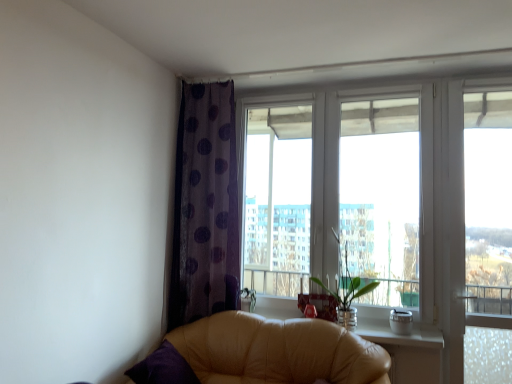
Question: Does point (232, 165) appear closer or farther from the camera than point (377, 372)?

Choices:
 (A) closer
 (B) farther

Answer: (B)

Question: From their relative heights in the image, would you say purple dotted curtain at left is taller or shorter than leather couch at lower left?

Choices:
 (A) tall
 (B) short

Answer: (A)

Question: Which is farther from the purple dotted curtain at left?

Choices:
 (A) green glass vase at center
 (B) leather couch at lower left
 (C) transparent plastic screen at right
 (D) transparent glass window at center

Answer: (C)

Question: Which object is positioned farthest from the leather couch at lower left?

Choices:
 (A) purple dotted curtain at left
 (B) transparent plastic screen at right
 (C) transparent glass window at center
 (D) green glass vase at center

Answer: (B)